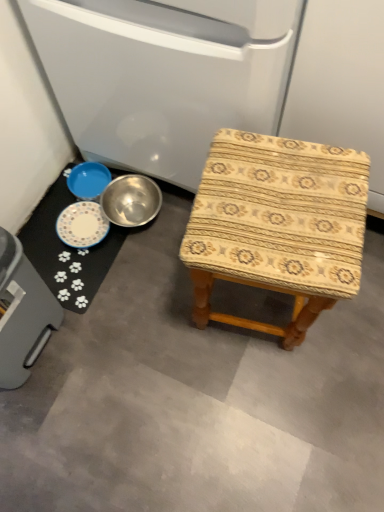
Question: Can you confirm if blue metallic bowl at lower left is positioned to the right of metallic bowl at lower left, the 2th appliance positioned from the left?

Choices:
 (A) yes
 (B) no

Answer: (B)

Question: Is blue metallic bowl at lower left to the left of metallic bowl at lower left, which ranks as the 1th appliance in right-to-left order, from the viewer's perspective?

Choices:
 (A) yes
 (B) no

Answer: (A)

Question: Is blue metallic bowl at lower left oriented towards metallic bowl at lower left, which ranks as the 1th appliance in right-to-left order?

Choices:
 (A) yes
 (B) no

Answer: (B)

Question: Is blue metallic bowl at lower left not near metallic bowl at lower left, the 1th appliance when ordered from top to bottom?

Choices:
 (A) no
 (B) yes

Answer: (A)

Question: Is blue metallic bowl at lower left further to camera compared to metallic bowl at lower left, the 1th appliance when ordered from top to bottom?

Choices:
 (A) no
 (B) yes

Answer: (B)

Question: Is blue metallic bowl at lower left turned away from metallic bowl at lower left, the 1th appliance when ordered from top to bottom?

Choices:
 (A) no
 (B) yes

Answer: (A)

Question: Is gray plastic trash can at lower left, which ranks as the first appliance in bottom-to-top order, located outside blue metallic bowl at lower left?

Choices:
 (A) no
 (B) yes

Answer: (B)

Question: From the image's perspective, does gray plastic trash can at lower left, which ranks as the first appliance in bottom-to-top order, appear lower than blue metallic bowl at lower left?

Choices:
 (A) no
 (B) yes

Answer: (B)

Question: Is gray plastic trash can at lower left, the 2th appliance when ordered from right to left, aimed at blue metallic bowl at lower left?

Choices:
 (A) no
 (B) yes

Answer: (A)

Question: From the image's perspective, is gray plastic trash can at lower left, acting as the second appliance starting from the top, on blue metallic bowl at lower left?

Choices:
 (A) no
 (B) yes

Answer: (A)

Question: Is gray plastic trash can at lower left, the 2th appliance when ordered from right to left, next to blue metallic bowl at lower left and touching it?

Choices:
 (A) yes
 (B) no

Answer: (B)

Question: Is gray plastic trash can at lower left, which ranks as the first appliance in bottom-to-top order, shorter than blue metallic bowl at lower left?

Choices:
 (A) no
 (B) yes

Answer: (A)

Question: From the image's perspective, is white paw print mat at lower left under gray plastic trash can at lower left, acting as the second appliance starting from the top?

Choices:
 (A) yes
 (B) no

Answer: (B)